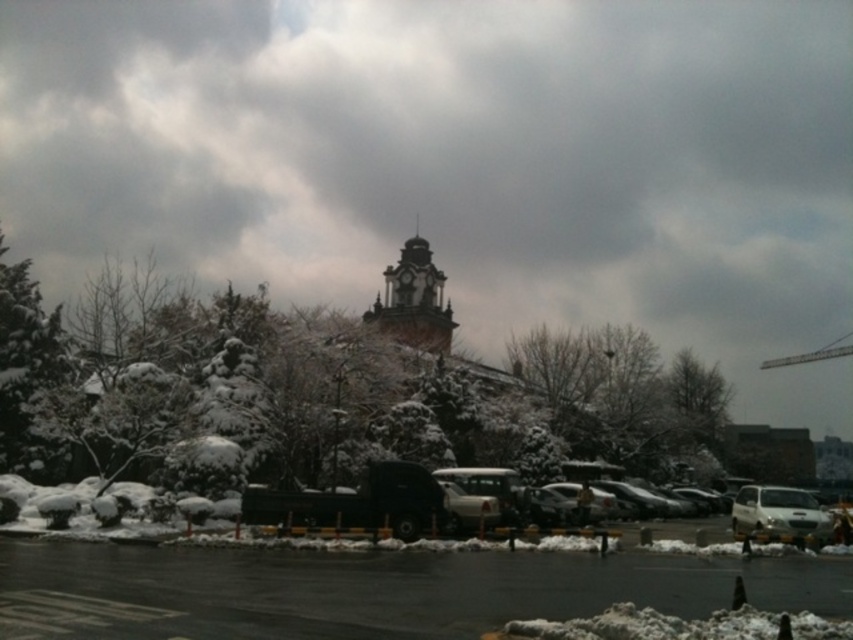
Which is above, snow-covered tree at center or white snow-covered tree at left?

snow-covered tree at center is higher up.

Which is in front, point (404, 380) or point (13, 353)?

Point (13, 353)

You are a GUI agent. You are given a task and a screenshot of the screen. Output one action in this format:
    pyautogui.click(x=<x>, y=<y>)
    Task: Click on the snow-covered tree at center
    
    Given the screenshot: What is the action you would take?
    pyautogui.click(x=351, y=385)

You are a GUI agent. You are given a task and a screenshot of the screen. Output one action in this format:
    pyautogui.click(x=<x>, y=<y>)
    Task: Click on the snow-covered tree at center
    This screenshot has height=640, width=853.
    Given the screenshot: What is the action you would take?
    pyautogui.click(x=351, y=385)

Is white snow-covered tree at left in front of white matte car at lower right?

No, it is behind white matte car at lower right.

Can you confirm if white snow-covered tree at left is taller than white matte car at lower right?

Indeed, white snow-covered tree at left has a greater height compared to white matte car at lower right.

Locate an element on the screen. The width and height of the screenshot is (853, 640). white snow-covered tree at left is located at coordinates (28, 372).

Identify the location of white snow-covered tree at left. The image size is (853, 640). (28, 372).

Is the position of black asphalt parking lot at lower center more distant than that of dark gray stone clock tower at center?

That is False.

Does black asphalt parking lot at lower center have a larger size compared to dark gray stone clock tower at center?

No, black asphalt parking lot at lower center is not bigger than dark gray stone clock tower at center.

Which is behind, point (473, 566) or point (379, 314)?

The point (379, 314) is more distant.

I want to click on black asphalt parking lot at lower center, so click(x=372, y=589).